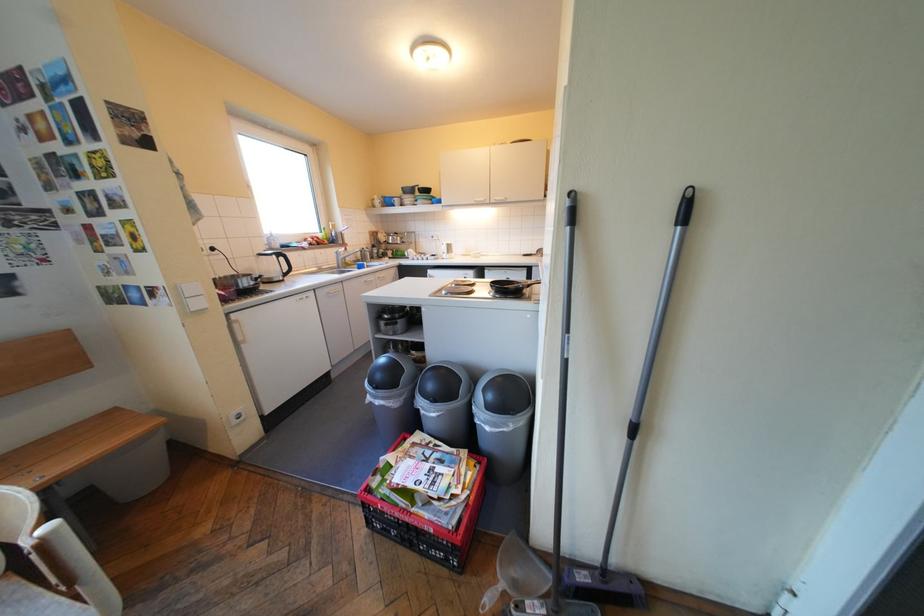
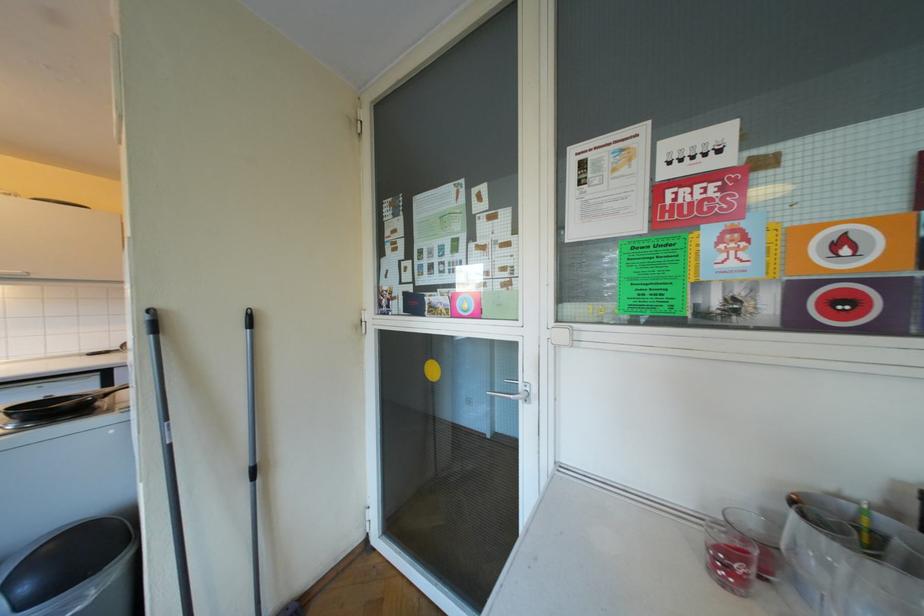
Question: The camera is either moving clockwise (left) or counter-clockwise (right) around the object. The first image is from the beginning of the video and the second image is from the end. Is the camera moving left or right when shooting the video?

Choices:
 (A) Left
 (B) Right

Answer: (A)